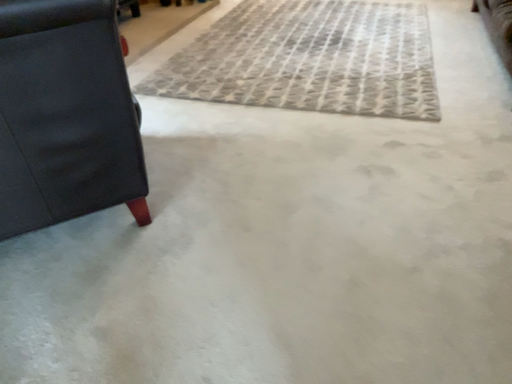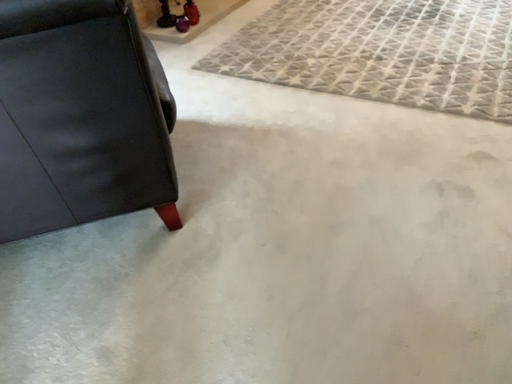
Question: How did the camera likely rotate when shooting the video?

Choices:
 (A) rotated right
 (B) rotated left

Answer: (B)